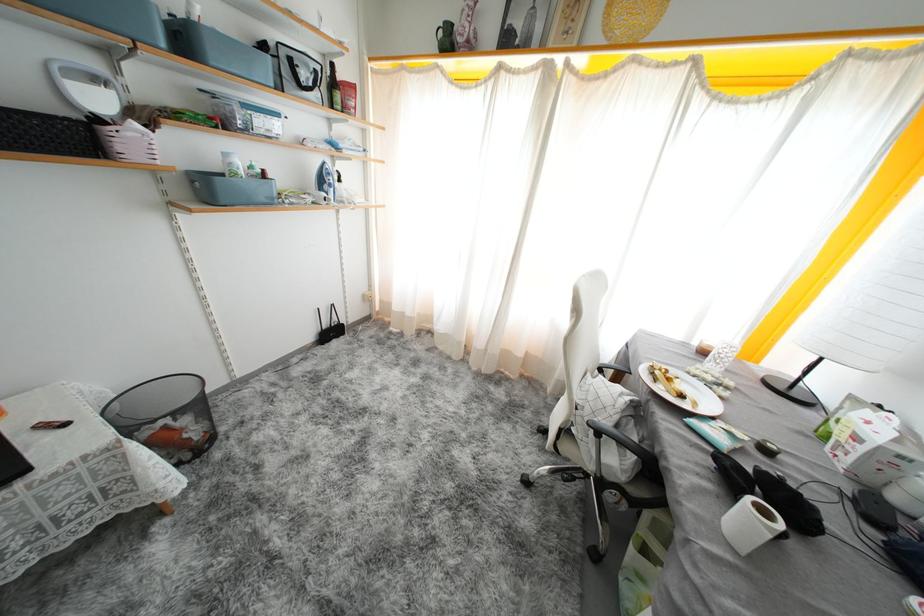
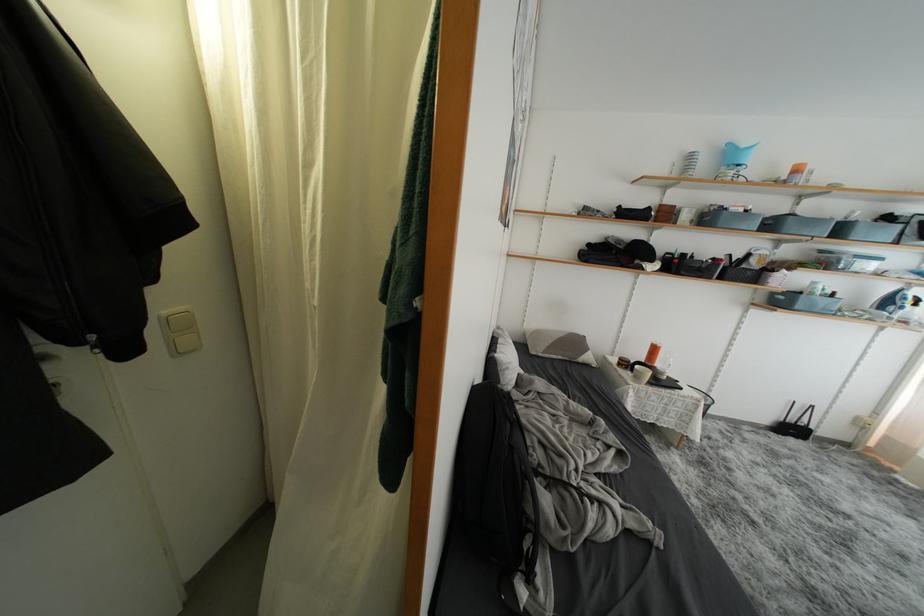
Find the pixel in the second image that matches [220,100] in the first image.

(829, 256)